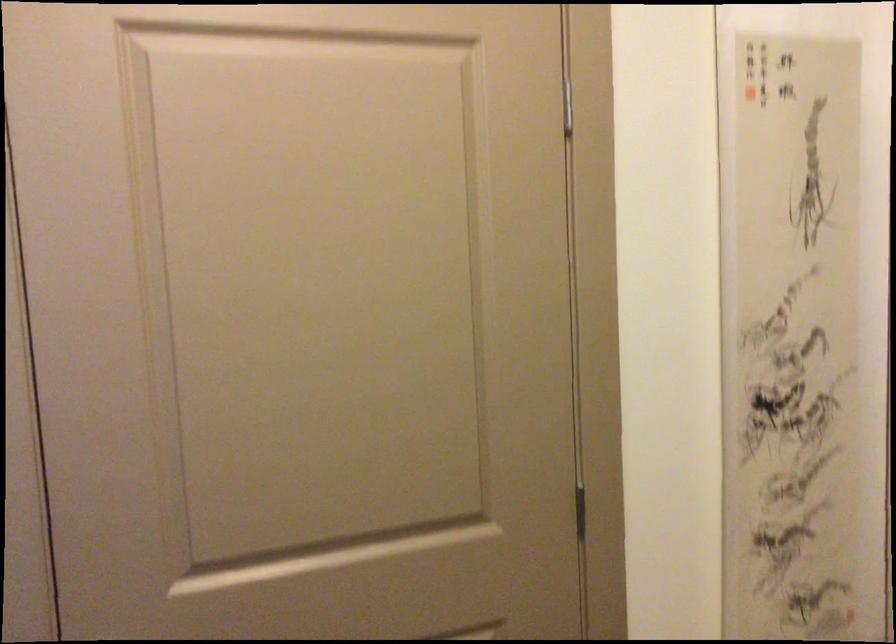
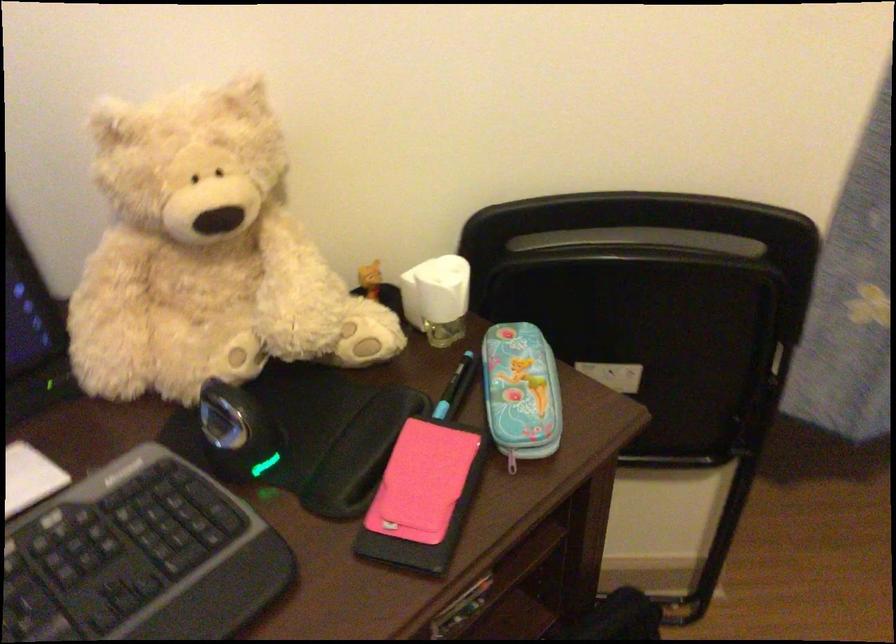
The images are taken continuously from a first-person perspective. In which direction is your viewpoint rotating?

The camera rotated toward left-down.